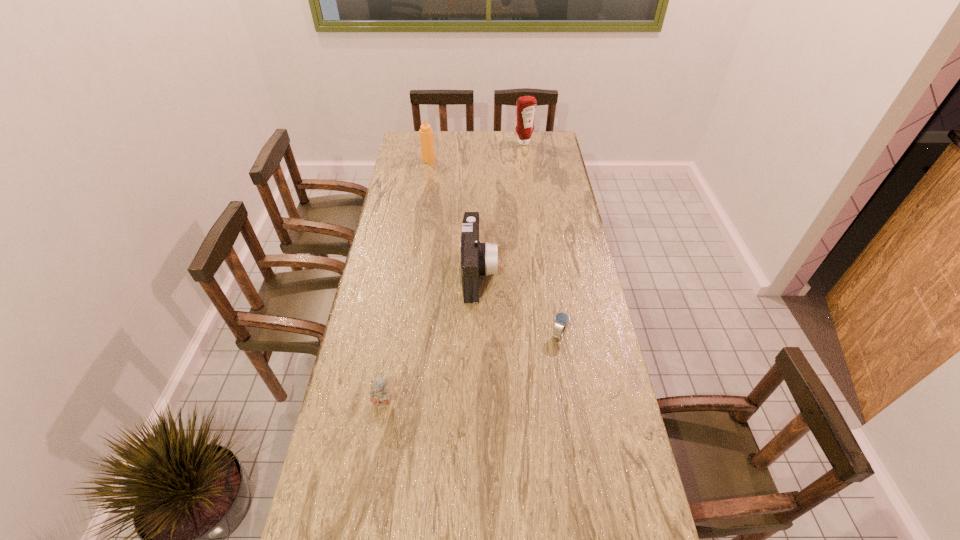
Find the location of a particular element. object that is positioned at the far right corner is located at coordinates (526, 106).

Find the location of a particular element. Image resolution: width=960 pixels, height=540 pixels. vacant space at the far edge of the desktop is located at coordinates (502, 147).

In the image, there is a desktop. Identify the location of vacant space at the left edge. The image size is (960, 540). (403, 201).

This screenshot has width=960, height=540. What are the coordinates of `free region at the right edge of the desktop` in the screenshot? It's located at (588, 334).

Locate an element on the screen. This screenshot has width=960, height=540. free location at the far right corner is located at coordinates (553, 141).

You are a GUI agent. You are given a task and a screenshot of the screen. Output one action in this format:
    pyautogui.click(x=<x>, y=<y>)
    Task: Click on the empty location between the shortest object and the farthest object
    
    Given the screenshot: What is the action you would take?
    pyautogui.click(x=541, y=238)

Where is `empty space that is in between the watch and the nearest object`? empty space that is in between the watch and the nearest object is located at coordinates (471, 368).

Locate an element on the screen. unoccupied position between the left condiment and the right condiment is located at coordinates (476, 151).

The width and height of the screenshot is (960, 540). What are the coordinates of `unoccupied area between the nearest object and the camcorder` in the screenshot? It's located at (431, 338).

Where is `empty space that is in between the fourth nearest object and the nearest object`? empty space that is in between the fourth nearest object and the nearest object is located at coordinates (406, 281).